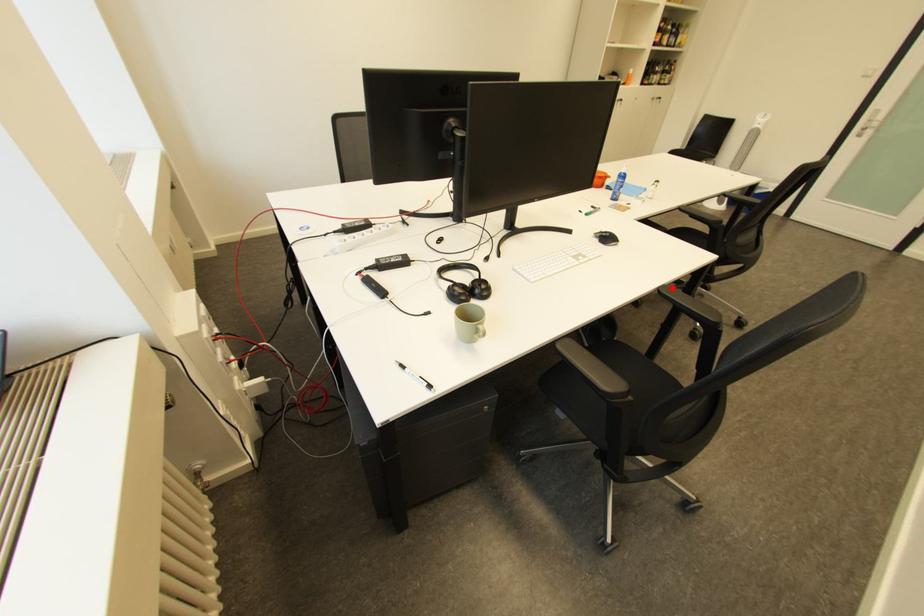
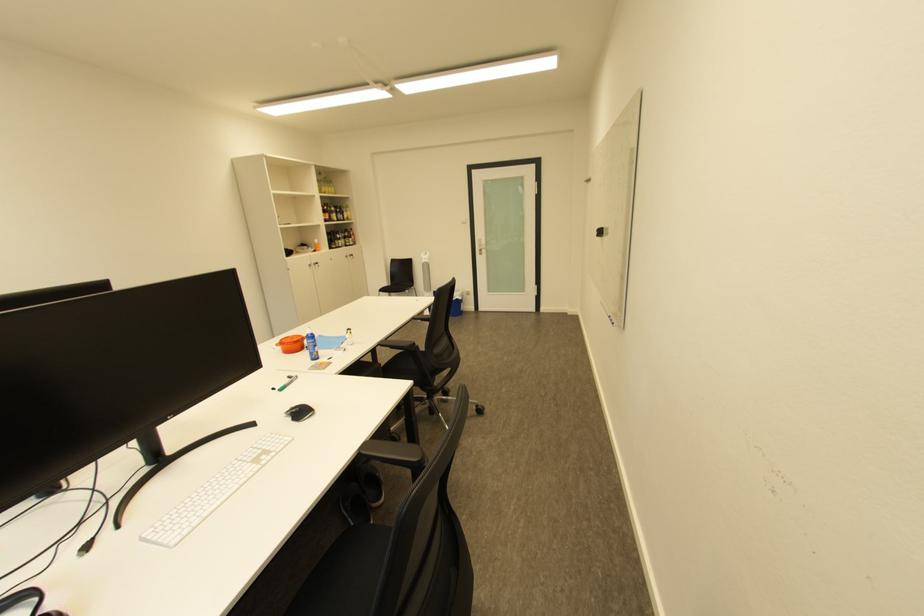
Question: I am providing you with two images of the same scene from different viewpoints. A red point is shown in image1. For the corresponding object point in image2, is it positioned nearer or farther from the camera?

Choices:
 (A) Nearer
 (B) Farther

Answer: (A)